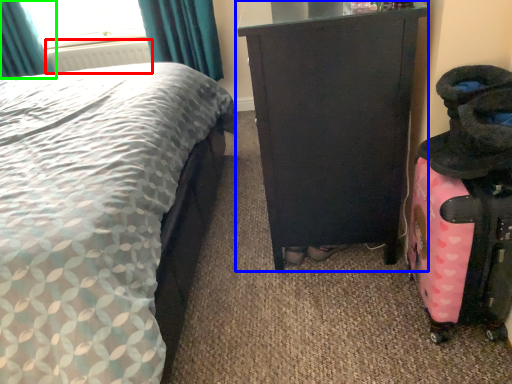
Question: Which is farther away from radiator (highlighted by a red box)? furniture (highlighted by a blue box) or curtain (highlighted by a green box)?

Choices:
 (A) furniture
 (B) curtain

Answer: (A)